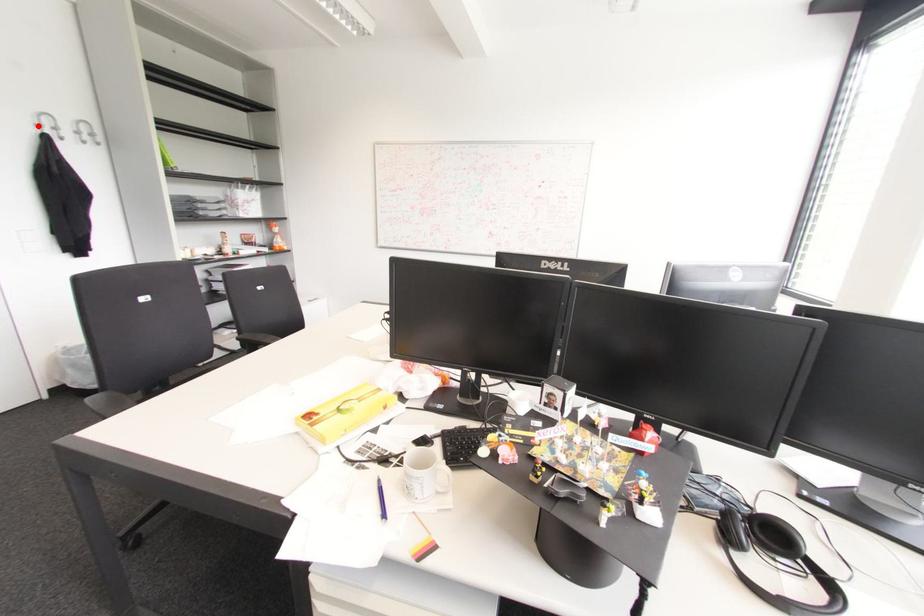
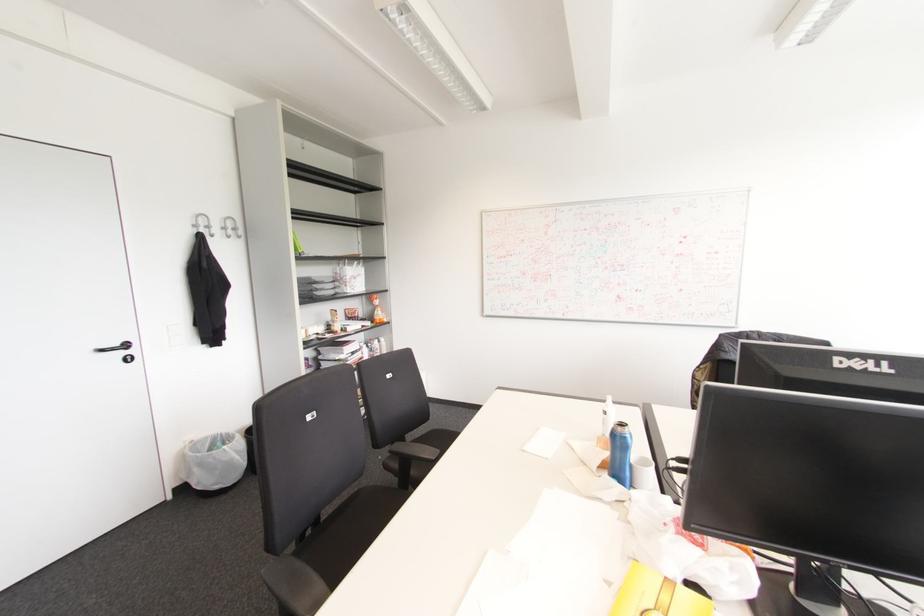
Question: I am providing you with two images of the same scene from different viewpoints. A red point is marked on the first image. At the location where the point appears in image 1, is it still visible in image 2?

Choices:
 (A) Yes
 (B) No

Answer: (A)